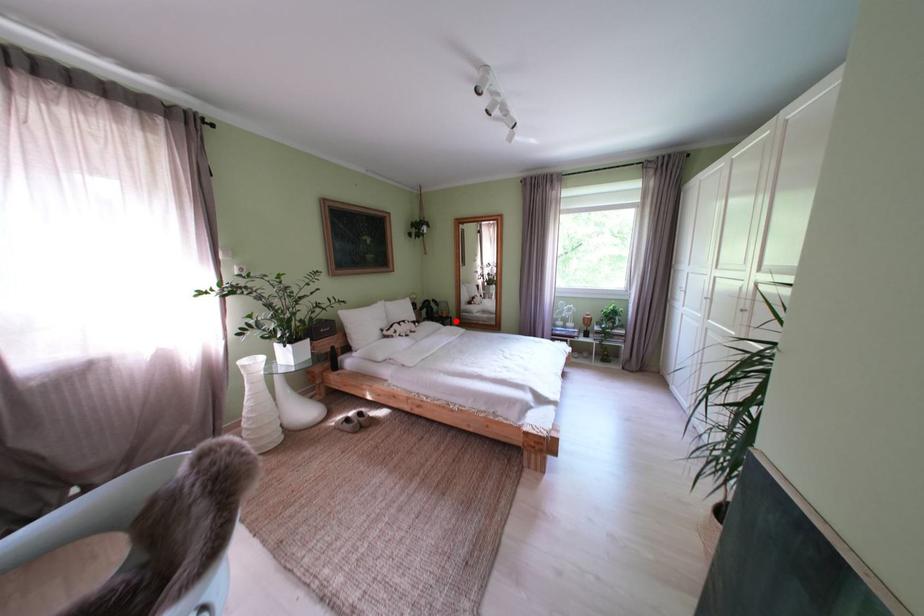
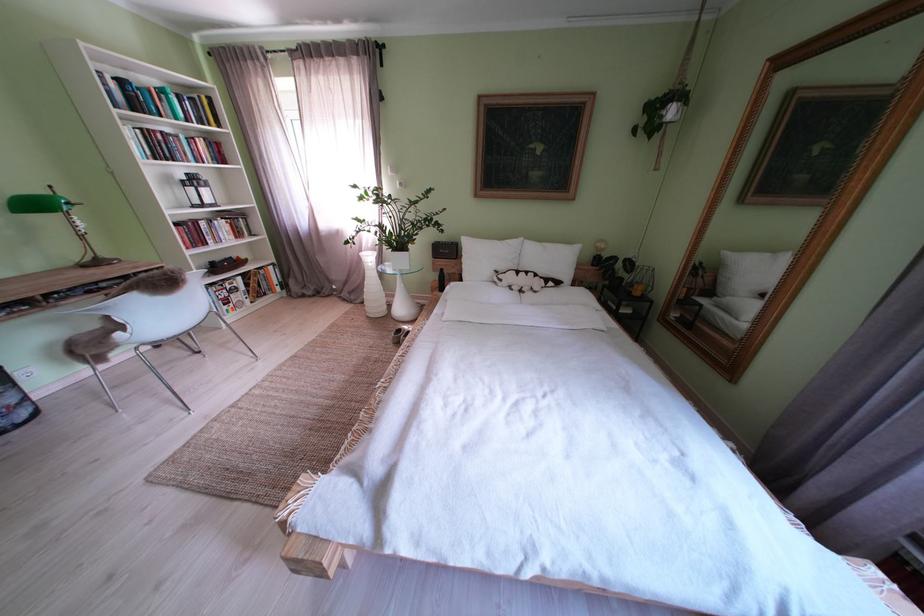
Question: I am providing you with two images of the same scene from different viewpoints. Given a red point in image1, look at the same physical point in image2. Is it:

Choices:
 (A) Closer to the viewpoint
 (B) Farther from the viewpoint

Answer: (A)